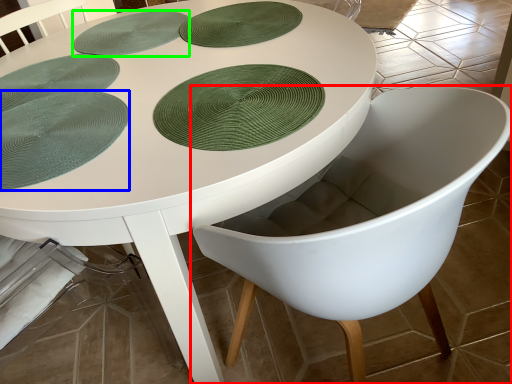
Question: Which is nearer to the chair (highlighted by a red box)? paper plate (highlighted by a blue box) or platter (highlighted by a green box).

Choices:
 (A) paper plate
 (B) platter

Answer: (A)